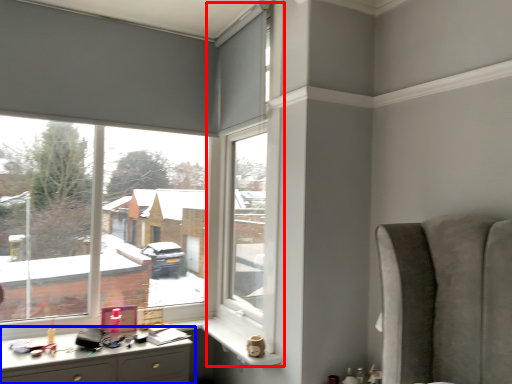
Question: Which of the following is the farthest to the observer, window frame (highlighted by a red box) or desk (highlighted by a blue box)?

Choices:
 (A) window frame
 (B) desk

Answer: (A)